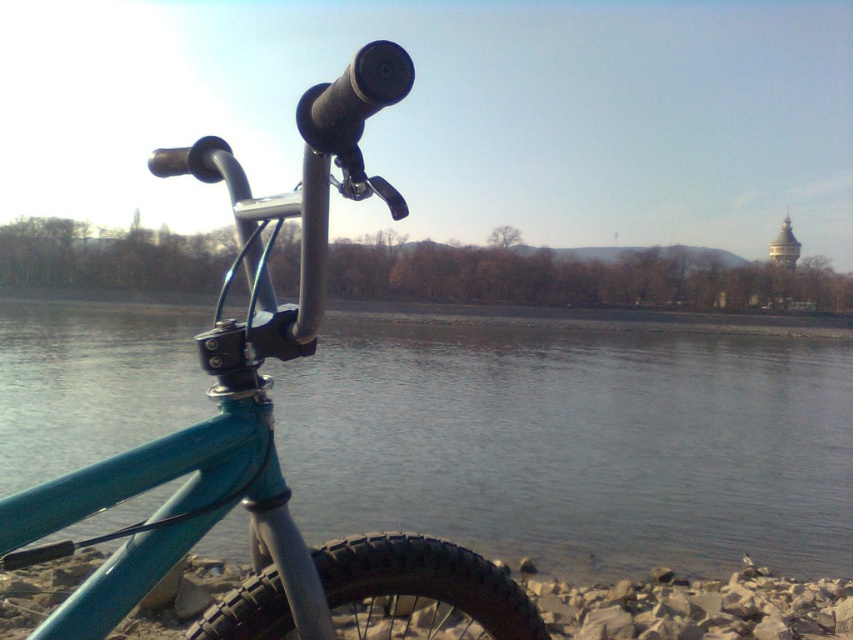
Which is more to the right, blue metallic water at lower center or teal matte bicycle at center?

teal matte bicycle at center

What do you see at coordinates (576, 440) in the screenshot? The width and height of the screenshot is (853, 640). I see `blue metallic water at lower center` at bounding box center [576, 440].

Which is in front, point (102, 337) or point (492, 609)?

Point (492, 609)

The height and width of the screenshot is (640, 853). In order to click on blue metallic water at lower center in this screenshot , I will do `click(576, 440)`.